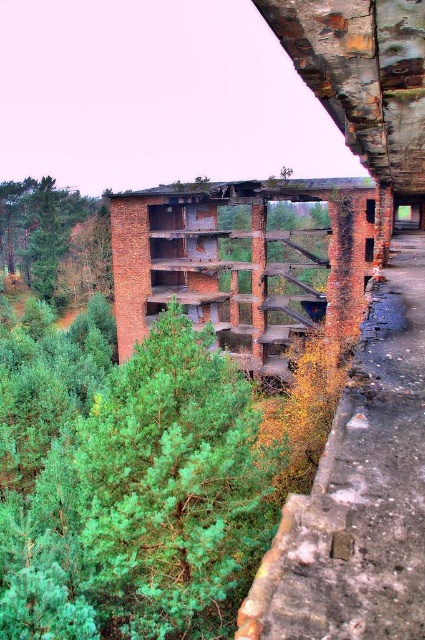
Question: Which of the following is the farthest from the observer?

Choices:
 (A) (17, 208)
 (B) (390, 184)
 (C) (257, 337)

Answer: (A)

Question: Can you confirm if rusty metal overpass at upper center is positioned to the left of green leafy tree at upper left?

Choices:
 (A) yes
 (B) no

Answer: (B)

Question: Which point is closer to the camera?

Choices:
 (A) green leafy tree at upper left
 (B) rusty brick bridge at center
 (C) rusty metal overpass at upper center

Answer: (C)

Question: Is rusty brick bridge at center to the left of green leafy tree at upper left from the viewer's perspective?

Choices:
 (A) yes
 (B) no

Answer: (B)

Question: Considering the relative positions of rusty brick bridge at center and green leafy tree at upper left in the image provided, where is rusty brick bridge at center located with respect to green leafy tree at upper left?

Choices:
 (A) right
 (B) left

Answer: (A)

Question: Which object is positioned farthest from the green leafy tree at upper left?

Choices:
 (A) rusty metal overpass at upper center
 (B) rusty brick bridge at center

Answer: (A)